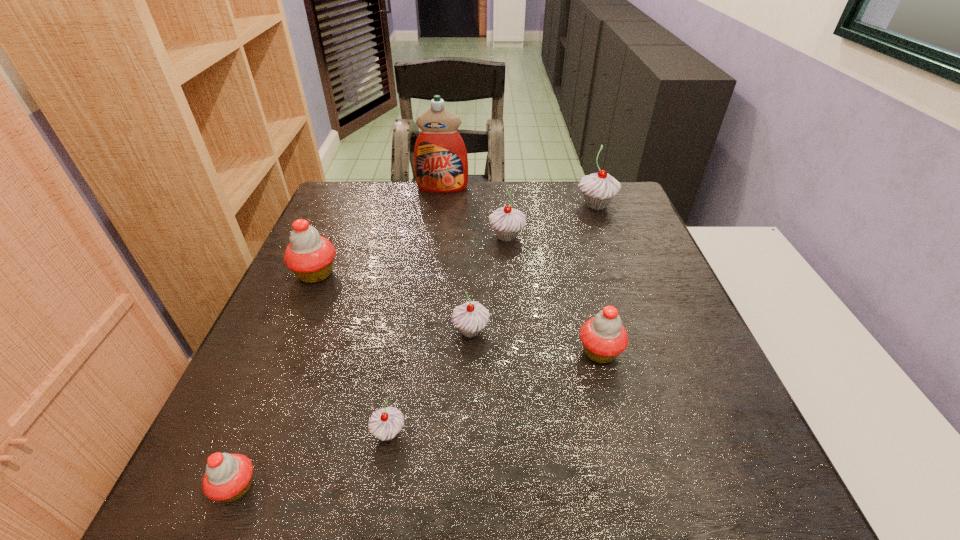
Image resolution: width=960 pixels, height=540 pixels. I want to click on free space located 0.250m on the right of the third farthest gray cupcake, so click(610, 331).

I want to click on free region located on the right of the rightmost red cupcake, so click(653, 352).

The width and height of the screenshot is (960, 540). I want to click on free location located on the back of the second nearest cupcake, so click(x=411, y=305).

I want to click on free region located 0.370m on the right of the nearest cupcake, so click(499, 487).

You are a GUI agent. You are given a task and a screenshot of the screen. Output one action in this format:
    pyautogui.click(x=<x>, y=<y>)
    Task: Click on the detergent located at the far edge
    The image size is (960, 540).
    Given the screenshot: What is the action you would take?
    pyautogui.click(x=440, y=158)

At what (x,y) coordinates should I click in order to perform the action: click on cupcake positioned at the far edge. Please return your answer as a coordinate pair (x, y). The image size is (960, 540). Looking at the image, I should click on (598, 189).

Find the location of a particular element. This screenshot has width=960, height=540. object that is at the near edge is located at coordinates (228, 477).

Locate an element on the screen. This screenshot has height=540, width=960. object situated at the right edge is located at coordinates (598, 189).

Where is `object that is at the near left corner`? This screenshot has width=960, height=540. object that is at the near left corner is located at coordinates (228, 477).

In order to click on object that is at the far right corner in this screenshot , I will do `click(598, 189)`.